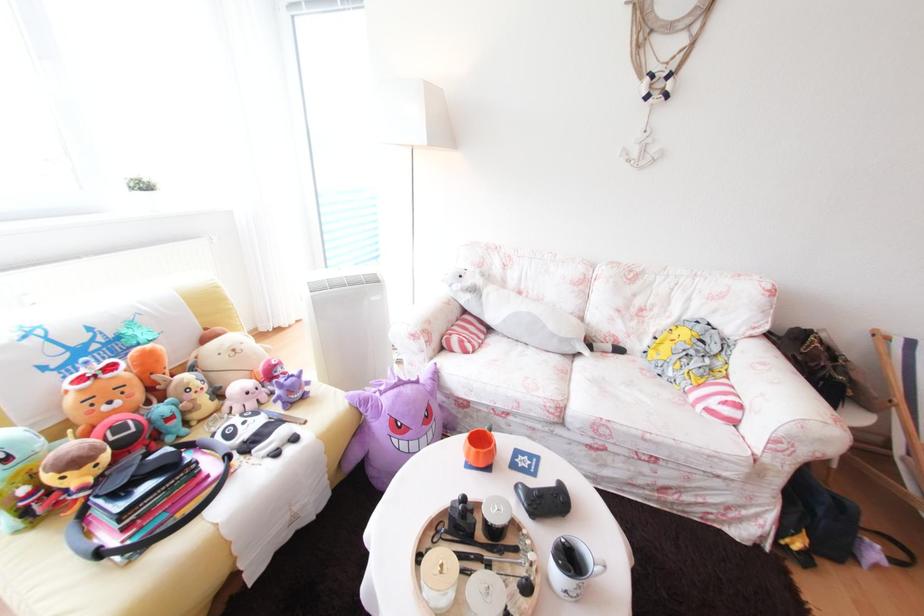
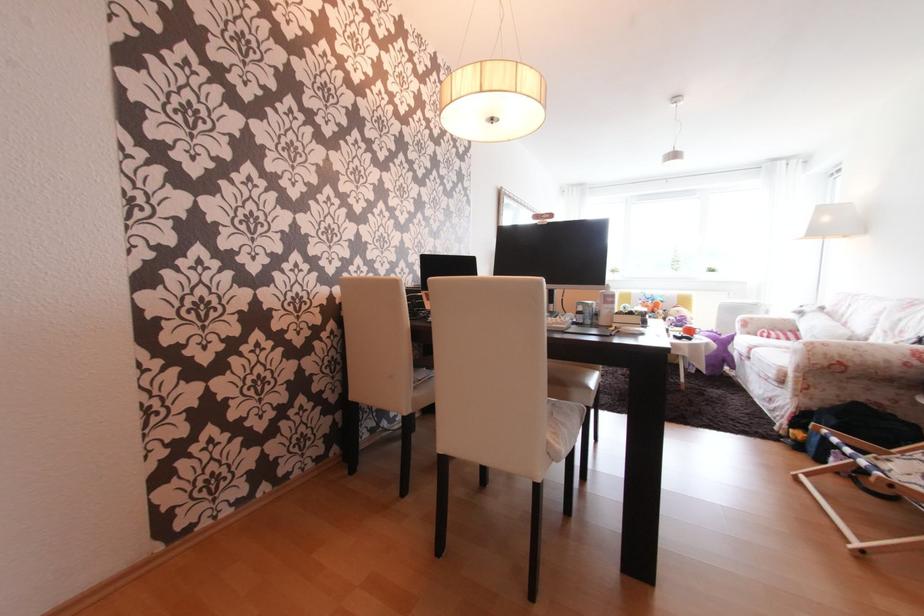
Where in the second image is the point corresponding to point (426, 383) from the first image?

(727, 336)